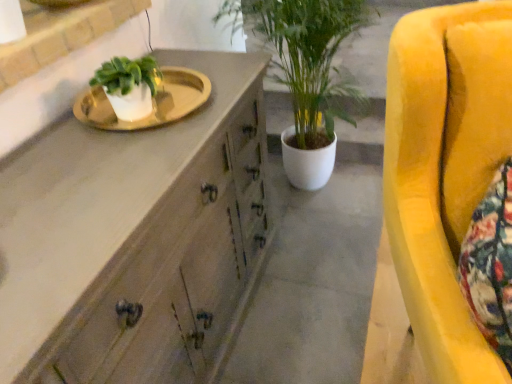
The image size is (512, 384). I want to click on free spot to the right of white glossy sink at upper left, so click(x=212, y=109).